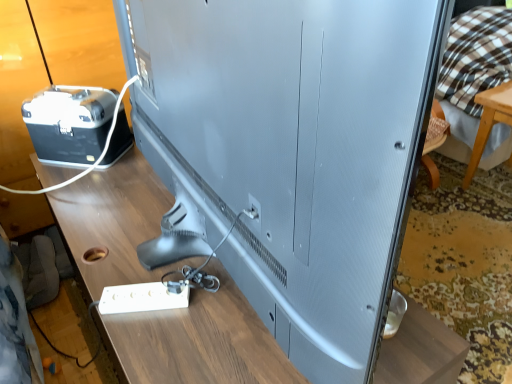
Where is `space that is in front of white plastic extension cord at lower left`? space that is in front of white plastic extension cord at lower left is located at coordinates (160, 345).